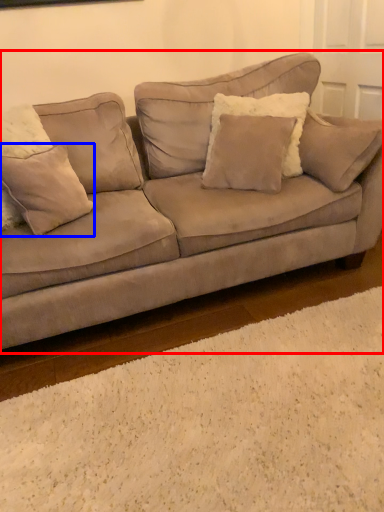
Question: Which object appears farthest to the camera in this image, studio couch (highlighted by a red box) or pillow (highlighted by a blue box)?

Choices:
 (A) studio couch
 (B) pillow

Answer: (B)